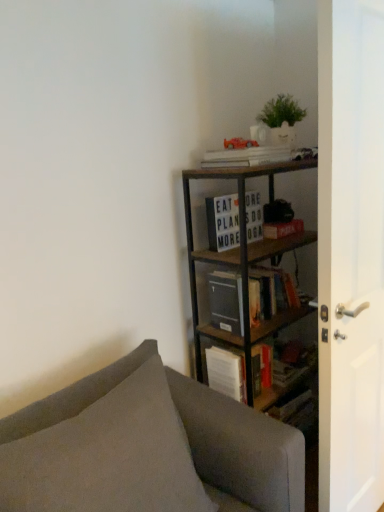
Question: Can you confirm if gray fabric couch at lower left is positioned to the right of white matte paperback book at upper center?

Choices:
 (A) no
 (B) yes

Answer: (A)

Question: From a real-world perspective, is gray fabric couch at lower left positioned over white matte paperback book at upper center based on gravity?

Choices:
 (A) no
 (B) yes

Answer: (A)

Question: Is gray fabric couch at lower left not within white matte paperback book at upper center?

Choices:
 (A) yes
 (B) no

Answer: (A)

Question: Is gray fabric couch at lower left in contact with white matte paperback book at upper center?

Choices:
 (A) yes
 (B) no

Answer: (B)

Question: Does gray fabric couch at lower left have a lesser height compared to white matte paperback book at upper center?

Choices:
 (A) no
 (B) yes

Answer: (A)

Question: From their relative heights in the image, would you say matte black book at center, the third book when ordered from top to bottom, is taller or shorter than white matte signboard at upper center, the second book in the bottom-to-top sequence?

Choices:
 (A) tall
 (B) short

Answer: (B)

Question: From a real-world perspective, is matte black book at center, positioned as the 1th book in bottom-to-top order, physically located above or below white matte signboard at upper center, the second book in the bottom-to-top sequence?

Choices:
 (A) above
 (B) below

Answer: (B)

Question: Does point (225, 283) appear closer or farther from the camera than point (248, 218)?

Choices:
 (A) closer
 (B) farther

Answer: (A)

Question: Considering the relative positions of matte black book at center, positioned as the 1th book in bottom-to-top order, and white matte signboard at upper center, the second book in the bottom-to-top sequence, in the image provided, is matte black book at center, positioned as the 1th book in bottom-to-top order, to the left or to the right of white matte signboard at upper center, the second book in the bottom-to-top sequence,?

Choices:
 (A) left
 (B) right

Answer: (B)

Question: Looking at the image, does white matte paperback book at upper center seem bigger or smaller compared to matte black book at center, positioned as the 1th book in bottom-to-top order?

Choices:
 (A) small
 (B) big

Answer: (A)

Question: In the image, is white matte paperback book at upper center on the left side or the right side of matte black book at center, the third book when ordered from top to bottom?

Choices:
 (A) right
 (B) left

Answer: (A)

Question: Is white matte paperback book at upper center situated inside matte black book at center, the third book when ordered from top to bottom, or outside?

Choices:
 (A) outside
 (B) inside

Answer: (A)

Question: Looking at their shapes, would you say white matte paperback book at upper center is wider or thinner than matte black book at center, positioned as the 1th book in bottom-to-top order?

Choices:
 (A) wide
 (B) thin

Answer: (B)

Question: From their relative heights in the image, would you say metallic brown bookcase at upper right is taller or shorter than white matte book at upper center, the 3th book when ordered from bottom to top?

Choices:
 (A) short
 (B) tall

Answer: (B)

Question: Choose the correct answer: Is metallic brown bookcase at upper right inside white matte book at upper center, the 3th book when ordered from bottom to top, or outside it?

Choices:
 (A) inside
 (B) outside

Answer: (B)